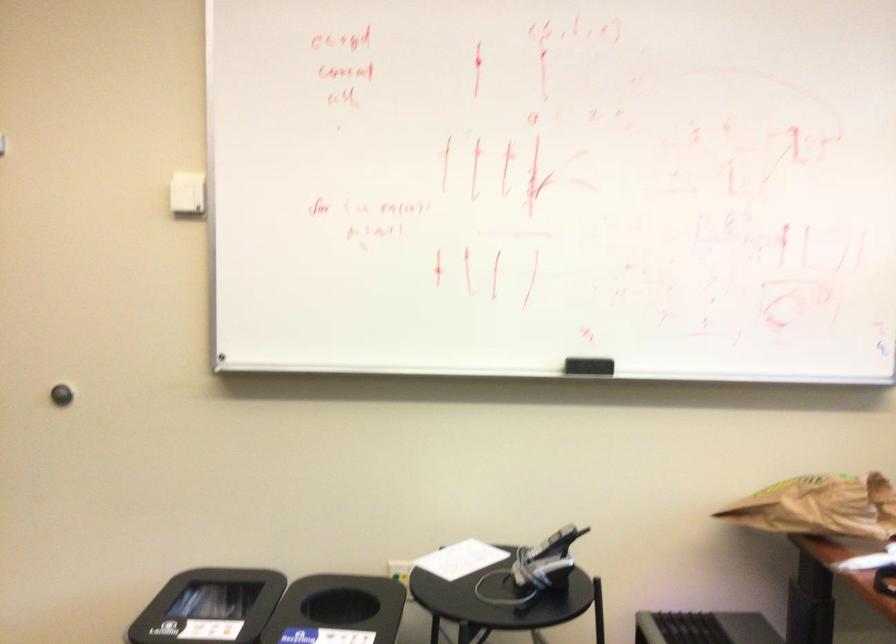
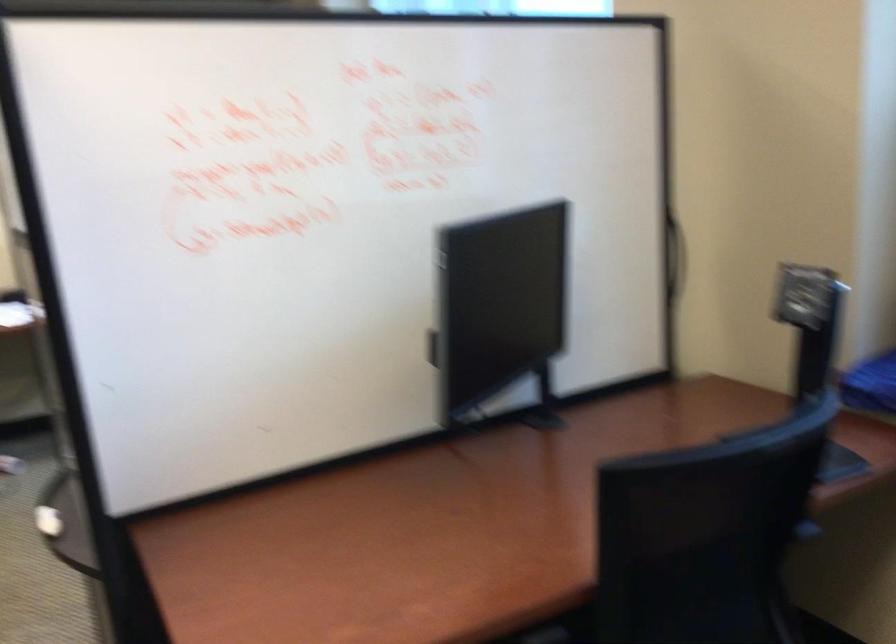
In a continuous first-person perspective shot, in which direction is the camera moving?

The movement direction of the cameraman is right, backward.